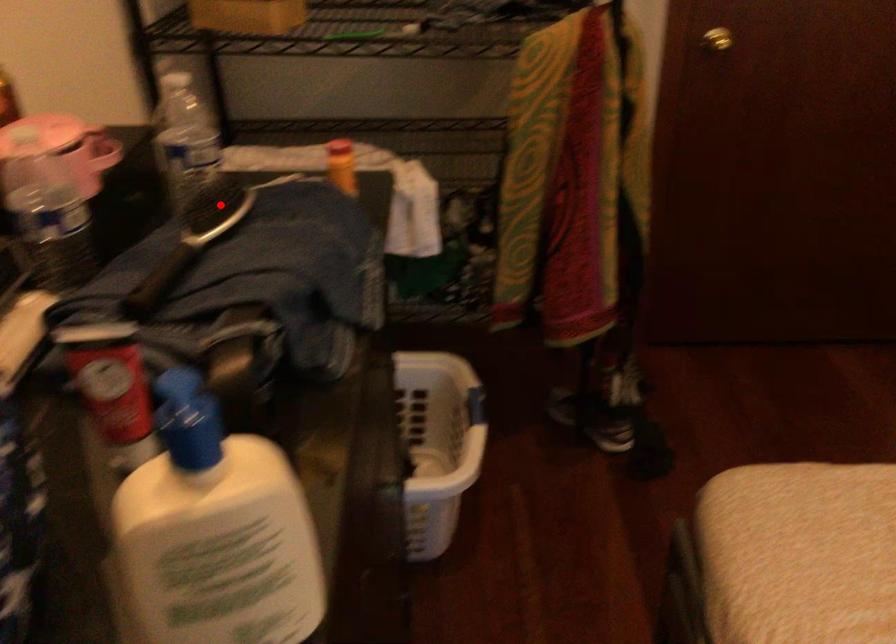
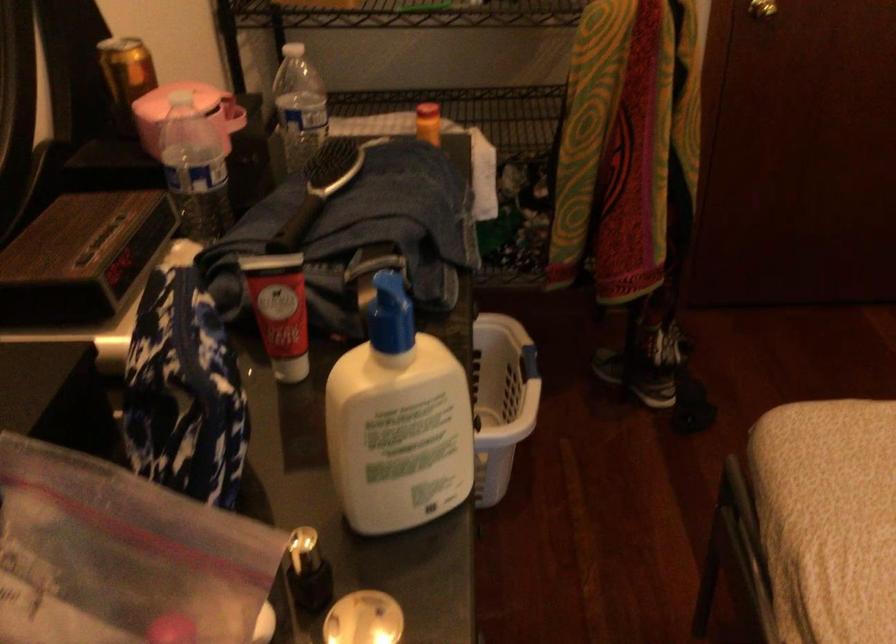
Locate, in the second image, the point that corresponds to the highlighted location in the first image.

(337, 164)